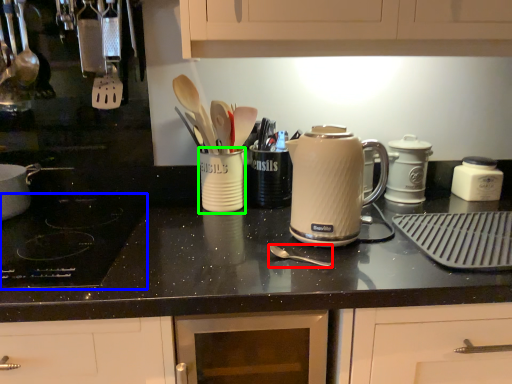
Question: Which object is positioned closest to utensil (highlighted by a red box)? Select from gas stove (highlighted by a blue box) and mug (highlighted by a green box).

Choices:
 (A) gas stove
 (B) mug

Answer: (B)